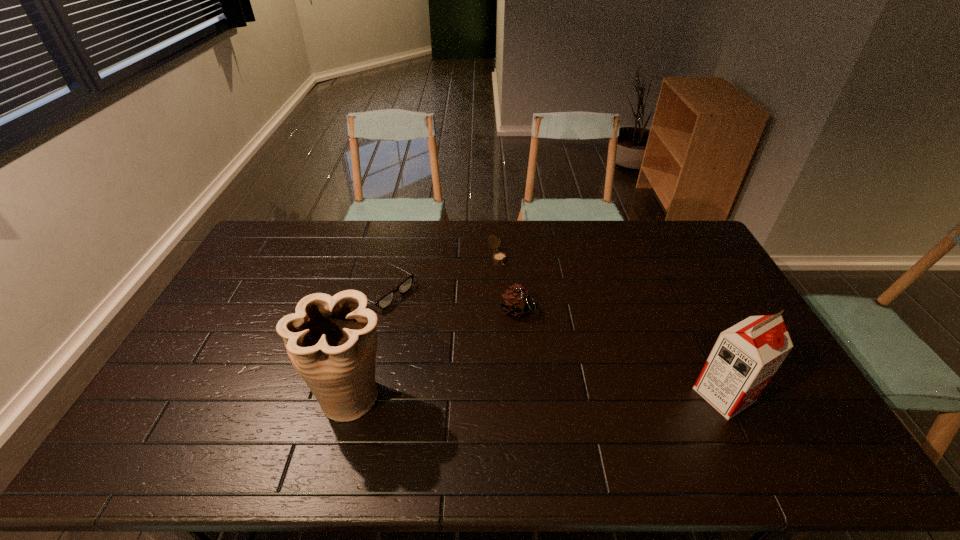
This screenshot has height=540, width=960. I want to click on urn, so click(331, 341).

Find the location of a particular element. the rightmost object is located at coordinates (745, 357).

The width and height of the screenshot is (960, 540). I want to click on the shortest object, so click(386, 300).

In order to click on pinecone in this screenshot , I will do `click(516, 301)`.

I want to click on the farthest object, so click(x=499, y=257).

I want to click on compass, so click(x=499, y=257).

Find the location of a particular element. The height and width of the screenshot is (540, 960). vacant space positioned 0.360m on the back of the urn is located at coordinates (381, 281).

Identify the location of free space located 0.370m on the back of the soya milk. (670, 284).

At what (x,y) coordinates should I click in order to perform the action: click on free space located on the front-facing side of the shortest object. Please return your answer as a coordinate pair (x, y). The image size is (960, 540). Looking at the image, I should click on (501, 359).

This screenshot has width=960, height=540. In order to click on free space located on the front-facing side of the shortest object in this screenshot , I will do `click(498, 357)`.